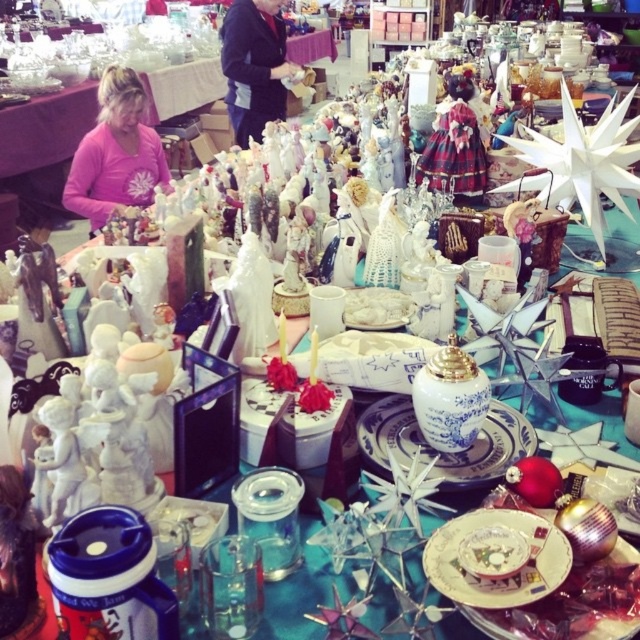
You are a vendor at the market and need to place a 12 inch long decorative box between the pink fabric shirt at center and the black fabric at upper center. Can you fit it without overlapping either item?

The distance between the pink fabric shirt at center and the black fabric at upper center is 31.92 inches. Since the box is 12 inches long, there is sufficient space to place it between them without overlapping either item.

You are a customer at the market and want to pick up the pink fabric shirt at center. If you are standing 10 feet away from the table, can you reach it without moving closer?

The pink fabric shirt at center is 7.89 feet away from you, so yes, you can reach it without moving closer since you are standing 10 feet away from the table.

You are a vendor at the market and need to determine which item takes up more space on the table. Which is larger in size between the pink fabric shirt at center and the black fabric at upper center?

The black fabric at upper center is larger in size compared to the pink fabric shirt at center.